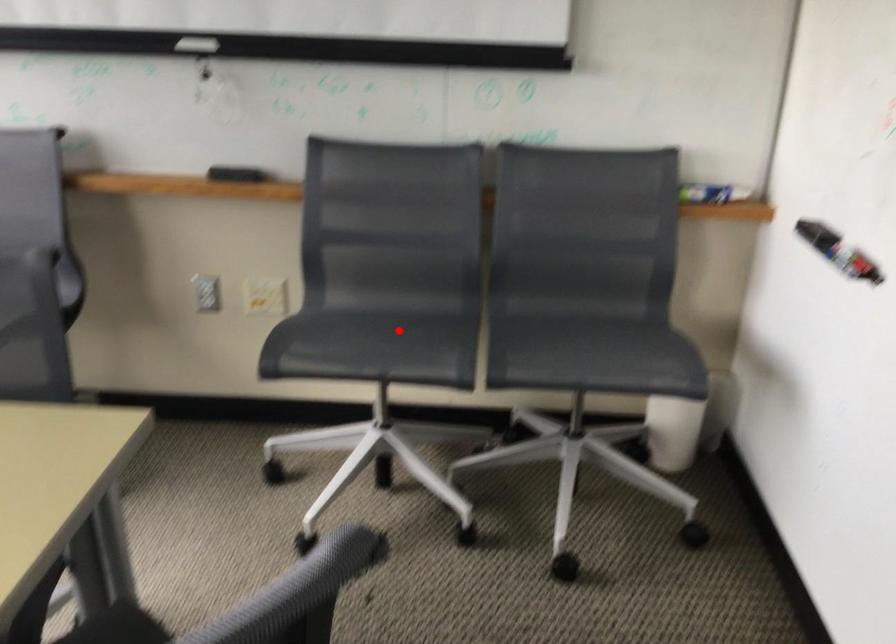
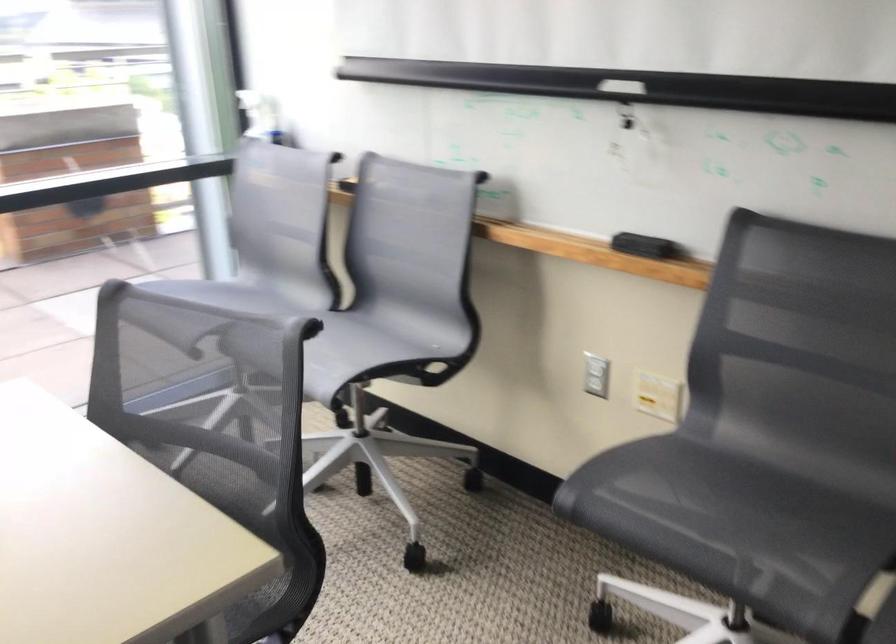
Locate, in the second image, the point that corresponds to the highlighted location in the first image.

(752, 506)